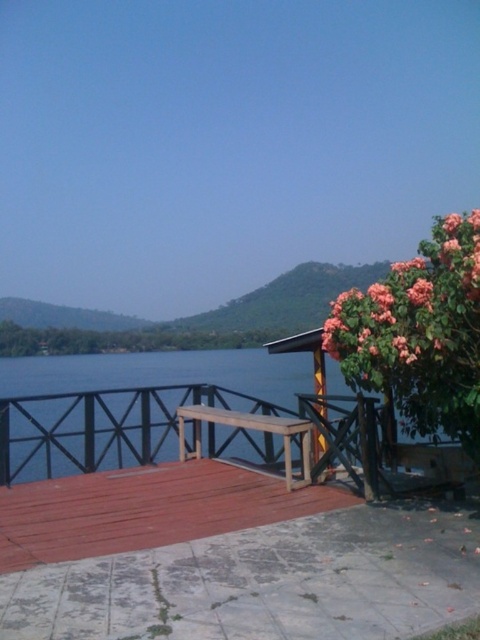
Question: Is pink matte flower at upper right closer to the viewer compared to wooden picnic table at center?

Choices:
 (A) yes
 (B) no

Answer: (A)

Question: Does pink matte flower at upper right appear over wooden picnic table at center?

Choices:
 (A) no
 (B) yes

Answer: (B)

Question: Can you confirm if pink matte flower at upper right is smaller than wooden picnic table at center?

Choices:
 (A) no
 (B) yes

Answer: (B)

Question: Which point is closer to the camera?

Choices:
 (A) pink matte flower at upper right
 (B) wooden picnic table at center

Answer: (A)